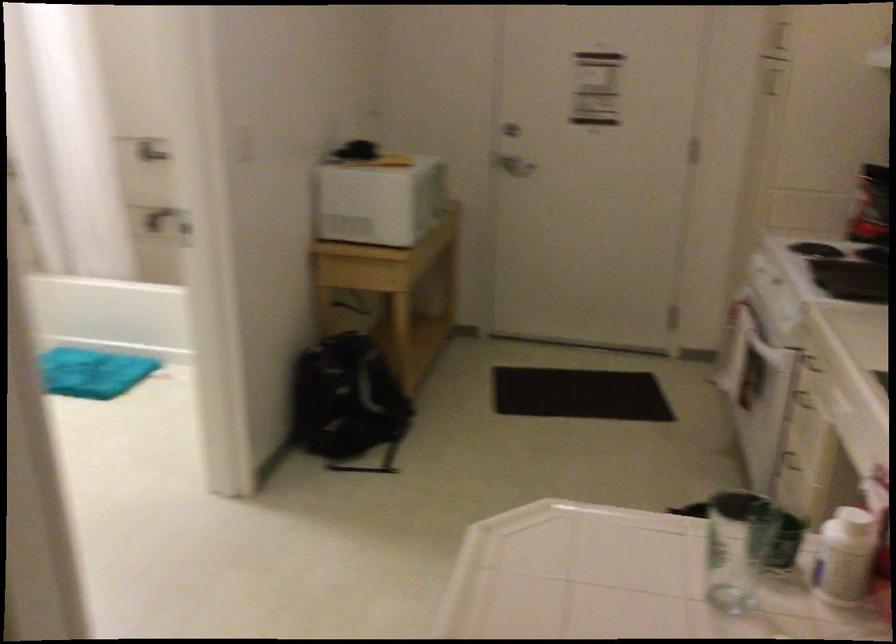
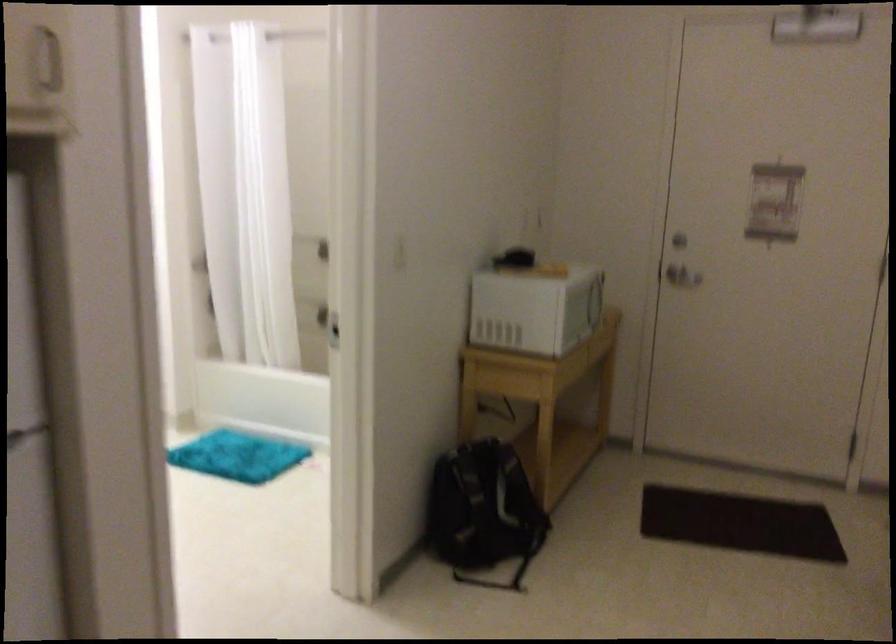
Question: The first image is from the beginning of the video and the second image is from the end. How did the camera likely rotate when shooting the video?

Choices:
 (A) Left
 (B) Right
 (C) Up
 (D) Down

Answer: (A)